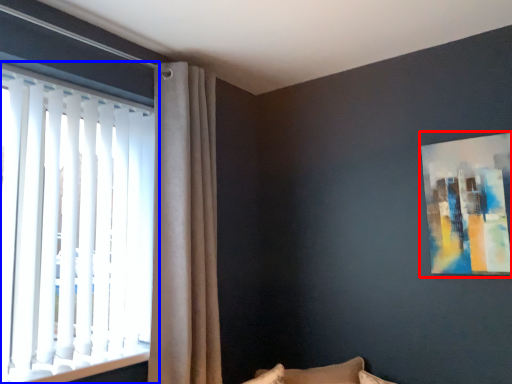
Question: Which of the following is the farthest to the observer, picture frame (highlighted by a red box) or window (highlighted by a blue box)?

Choices:
 (A) picture frame
 (B) window

Answer: (A)